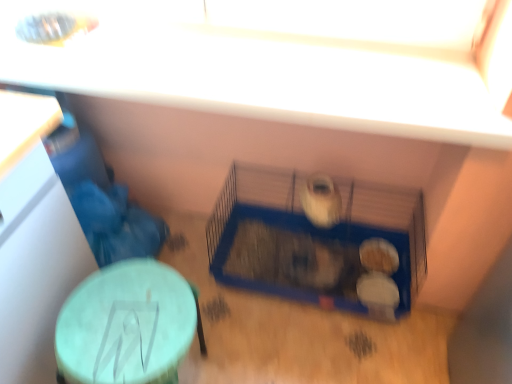
Image resolution: width=512 pixels, height=384 pixels. Identify the location of vacant area that is in front of blue plastic cage at center. (259, 327).